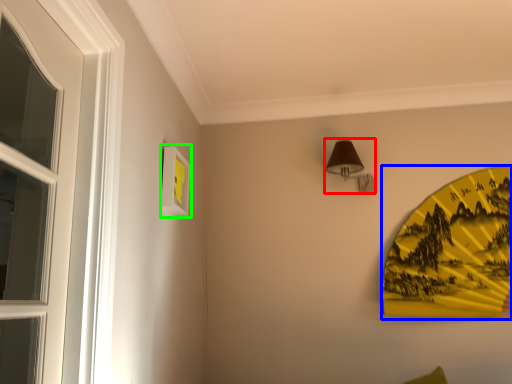
Question: Based on their relative distances, which object is nearer to lamp (highlighted by a red box)? Choose from design (highlighted by a blue box) and picture frame (highlighted by a green box).

Choices:
 (A) design
 (B) picture frame

Answer: (A)